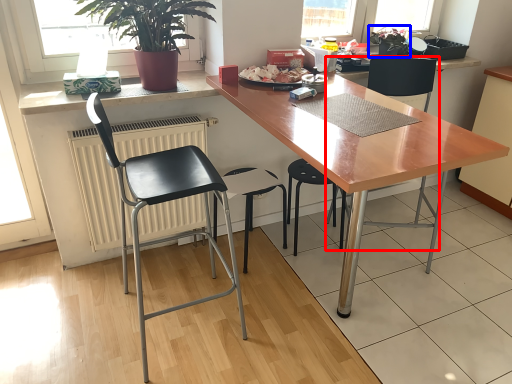
Question: Which of the following is the closest to the observer, chair (highlighted by a red box) or houseplant (highlighted by a blue box)?

Choices:
 (A) chair
 (B) houseplant

Answer: (A)